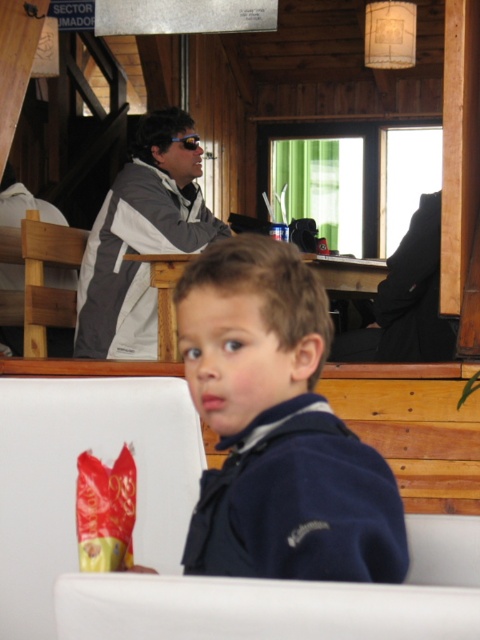
You are a person trying to sit down in the cafe. There are two seats available. One is the wooden chair at left and the other is the gray fabric jacket at upper left. Which seat is smaller in size?

The wooden chair at left is smaller in size compared to the gray fabric jacket at upper left.

You are a customer entering the cafe and want to sit down. There is a wooden chair at left and a gray fabric jacket at upper left. Which object is narrower so you can easily pass through the space between them?

The wooden chair at left is narrower than the gray fabric jacket at upper left, so you can easily pass through the space between them.